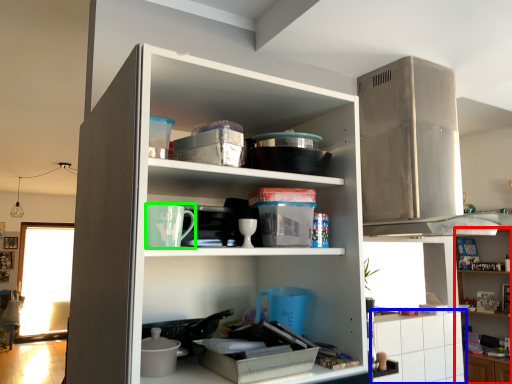
Question: Which object is the closest to the cabinet (highlighted by a red box)? Choose among these: cabinetry (highlighted by a blue box) or appliance (highlighted by a green box).

Choices:
 (A) cabinetry
 (B) appliance

Answer: (A)